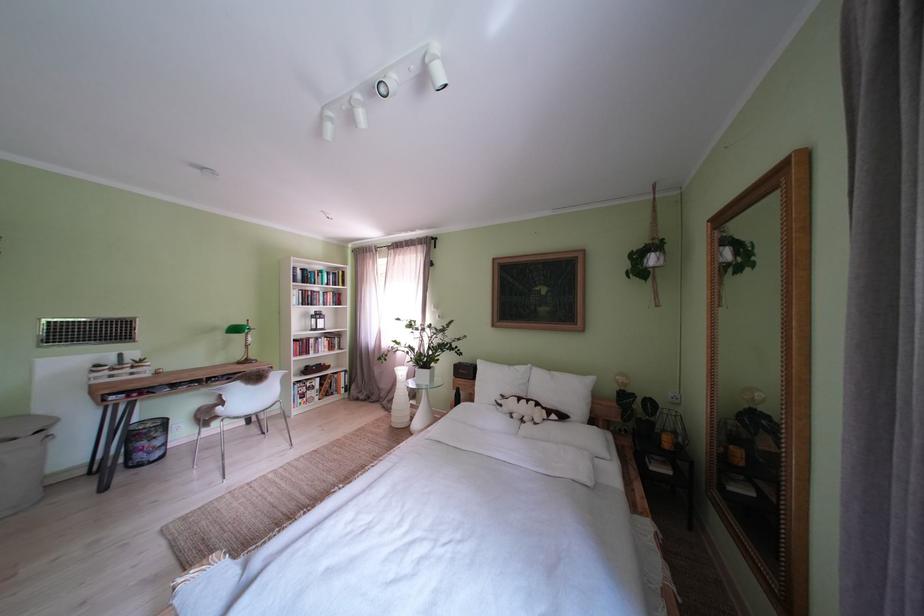
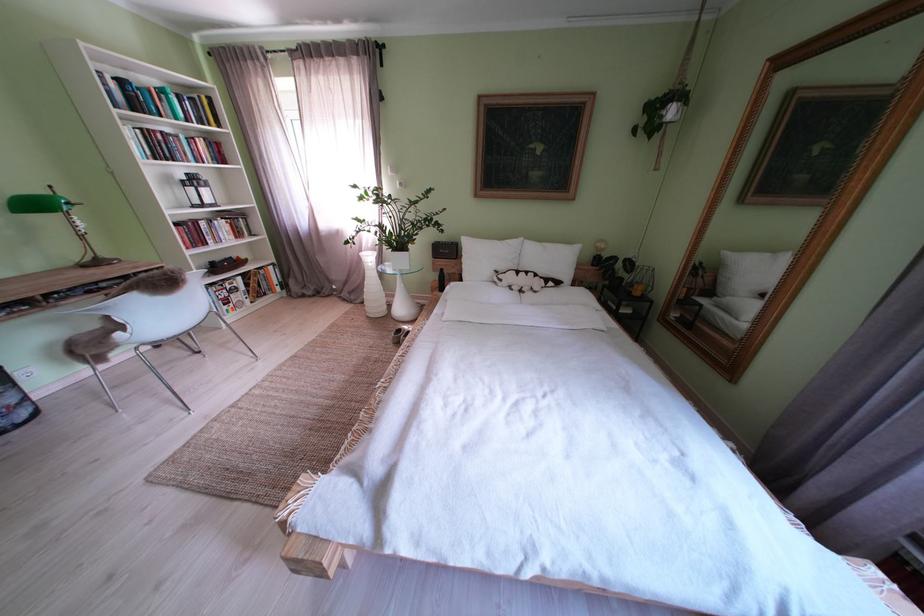
Locate, in the second image, the point that corresponds to point 247,334 in the first image.

(46, 209)